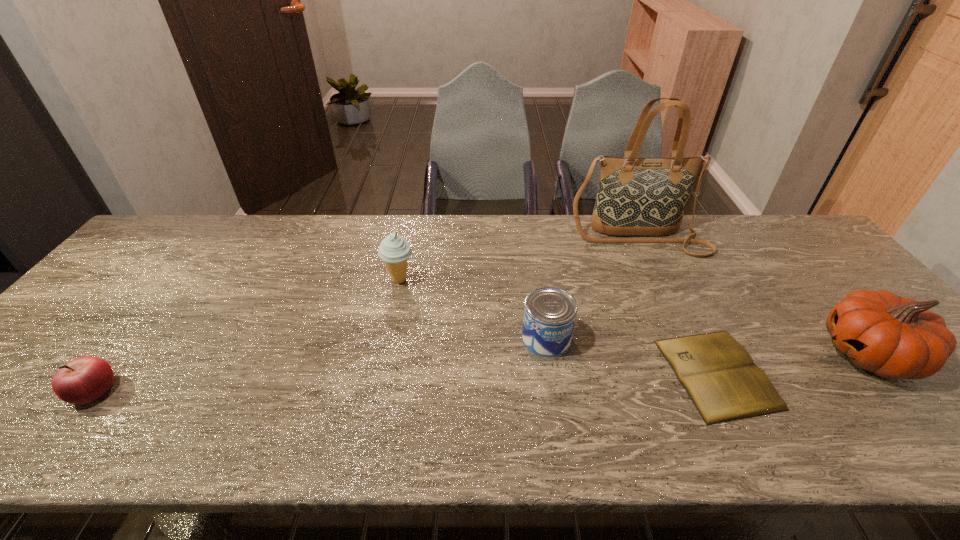
The height and width of the screenshot is (540, 960). In order to click on object that is at the left edge in this screenshot , I will do `click(83, 380)`.

Find the location of a particular element. The width and height of the screenshot is (960, 540). object at the right edge is located at coordinates (895, 337).

You are a GUI agent. You are given a task and a screenshot of the screen. Output one action in this format:
    pyautogui.click(x=<x>, y=<y>)
    Task: Click on the vacant region at the far edge
    The image size is (960, 540).
    Given the screenshot: What is the action you would take?
    pyautogui.click(x=285, y=237)

In the image, there is a desktop. Identify the location of free space at the near edge. The height and width of the screenshot is (540, 960). (524, 437).

Where is `vacant space at the left edge`? vacant space at the left edge is located at coordinates (110, 314).

In the image, there is a desktop. Where is `vacant space at the right edge`? The width and height of the screenshot is (960, 540). vacant space at the right edge is located at coordinates (815, 293).

The width and height of the screenshot is (960, 540). I want to click on empty location between the second farthest object and the fifth tallest object, so click(247, 335).

This screenshot has height=540, width=960. In order to click on free spot between the rightmost object and the second shortest object in this screenshot , I will do `click(481, 372)`.

I want to click on vacant space that is in between the second object from left to right and the pumpkin, so click(635, 317).

I want to click on free space between the shortest object and the apple, so click(x=405, y=382).